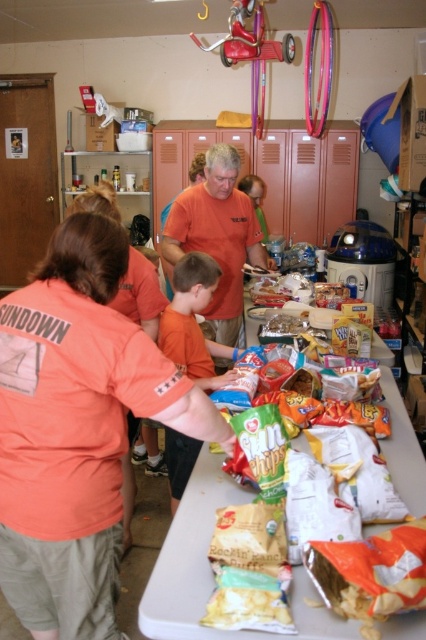
You are planning to set up a snack table for an event. You have a white plastic table at center and an orange cotton shirt at center. Which object is wider?

The orange cotton shirt at center is wider than the white plastic table at center according to the description.

You are planning to set up a new activity station at the community center. You have a large poster that needs to be displayed on the white plastic table at center or the orange cotton shirt at center. Based on their sizes, which object would be more suitable for displaying the poster?

The orange cotton shirt at center occupies more space than the white plastic table at center, so the orange cotton shirt at center would be more suitable for displaying the large poster.

You are at the community center and need to place a large poster on the wall behind the white plastic table at center and orange cotton shirt at center. Since the table is in the way, which object should you move to access the wall space behind both items?

You should move the white plastic table at center because it is to the left of the orange cotton shirt at center and thus closer to the wall, making it easier to access the space behind both items.